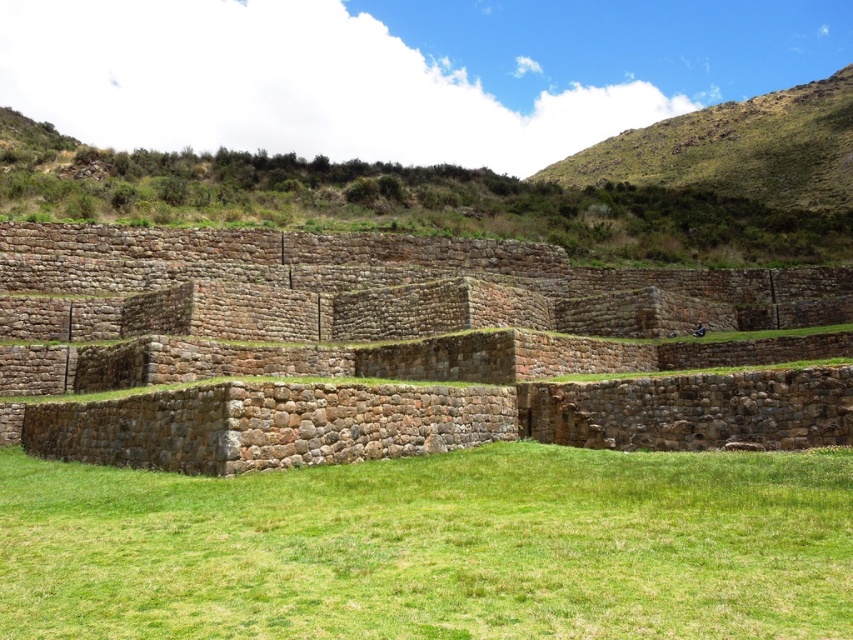
You are a tourist standing at the bottom of the stone terraces. You see the green grass at center and the brown stone wall at upper center. Which one is taller?

The brown stone wall at upper center is taller than the green grass at center.